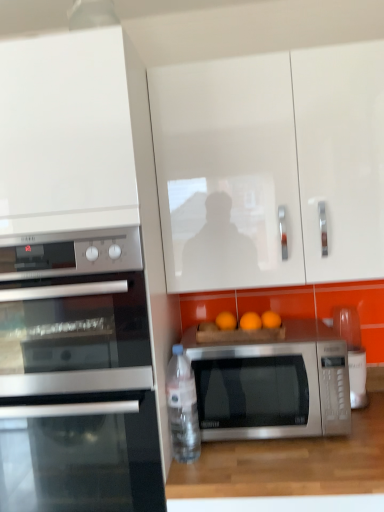
Question: Considering the relative sizes of wooden at lower center and white glossy cabinet at upper center, placed as the first cabinetry when sorted from right to left, in the image provided, is wooden at lower center thinner than white glossy cabinet at upper center, placed as the first cabinetry when sorted from right to left,?

Choices:
 (A) yes
 (B) no

Answer: (B)

Question: From the image's perspective, is wooden at lower center located beneath white glossy cabinet at upper center, placed as the 2th cabinetry when sorted from left to right?

Choices:
 (A) yes
 (B) no

Answer: (A)

Question: Can you confirm if wooden at lower center is smaller than white glossy cabinet at upper center, placed as the 2th cabinetry when sorted from left to right?

Choices:
 (A) yes
 (B) no

Answer: (A)

Question: Is wooden at lower center outside white glossy cabinet at upper center, placed as the first cabinetry when sorted from right to left?

Choices:
 (A) yes
 (B) no

Answer: (A)

Question: Is wooden at lower center facing towards white glossy cabinet at upper center, placed as the first cabinetry when sorted from right to left?

Choices:
 (A) no
 (B) yes

Answer: (A)

Question: Is satin silver microwave at left, the 2th microwave oven positioned from the right, wider or thinner than satin black oven at left?

Choices:
 (A) wide
 (B) thin

Answer: (B)

Question: Considering the positions of satin silver microwave at left, positioned as the 1th microwave oven in left-to-right order, and satin black oven at left in the image, is satin silver microwave at left, positioned as the 1th microwave oven in left-to-right order, bigger or smaller than satin black oven at left?

Choices:
 (A) big
 (B) small

Answer: (B)

Question: From a real-world perspective, relative to satin black oven at left, is satin silver microwave at left, the 2th microwave oven positioned from the right, vertically above or below?

Choices:
 (A) below
 (B) above

Answer: (B)

Question: From their relative heights in the image, would you say satin silver microwave at left, positioned as the 1th microwave oven in left-to-right order, is taller or shorter than satin black oven at left?

Choices:
 (A) tall
 (B) short

Answer: (B)

Question: From the image's perspective, is satin silver microwave at center, positioned as the second microwave oven in left-to-right order, located above or below satin black oven at left?

Choices:
 (A) above
 (B) below

Answer: (A)

Question: Is point (329, 360) positioned closer to the camera than point (34, 406)?

Choices:
 (A) farther
 (B) closer

Answer: (A)

Question: Looking at the image, does satin silver microwave at center, placed as the first microwave oven when sorted from right to left, seem bigger or smaller compared to satin black oven at left?

Choices:
 (A) big
 (B) small

Answer: (B)

Question: Looking at their shapes, would you say satin silver microwave at center, positioned as the second microwave oven in left-to-right order, is wider or thinner than satin black oven at left?

Choices:
 (A) wide
 (B) thin

Answer: (B)

Question: Based on their sizes in the image, would you say satin black oven at left is bigger or smaller than white glossy cabinet at upper left, which is the 2th cabinetry from right to left?

Choices:
 (A) small
 (B) big

Answer: (A)

Question: From the image's perspective, is satin black oven at left positioned above or below white glossy cabinet at upper left, which is the 2th cabinetry from right to left?

Choices:
 (A) below
 (B) above

Answer: (A)